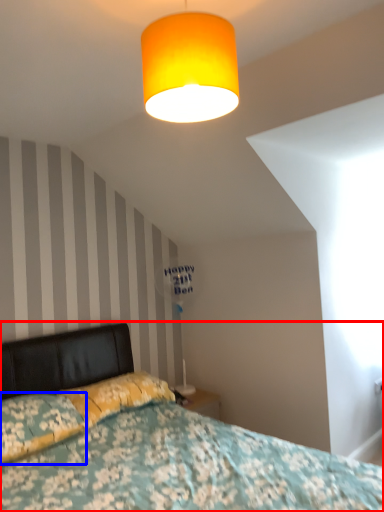
Question: Among these objects, which one is nearest to the camera, bed (highlighted by a red box) or pillow (highlighted by a blue box)?

Choices:
 (A) bed
 (B) pillow

Answer: (A)